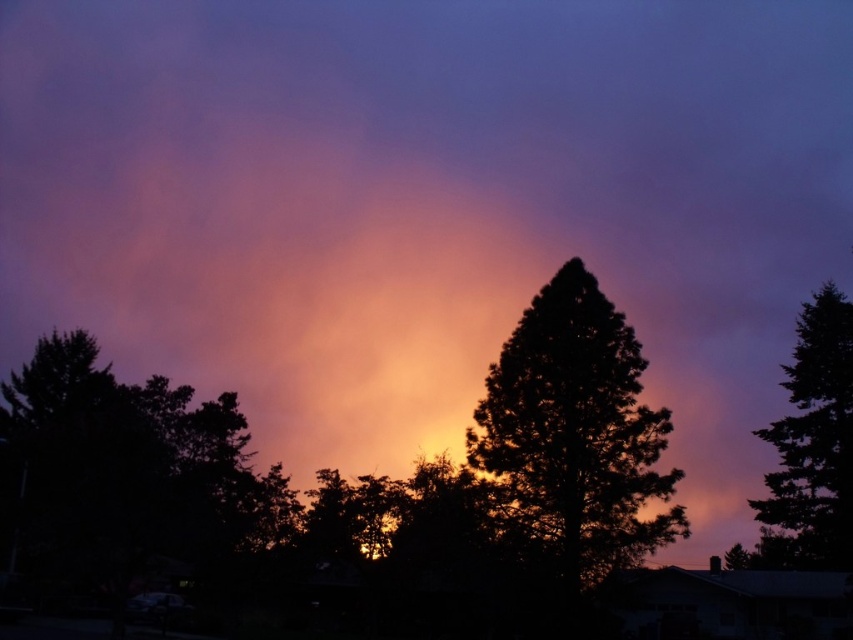
You are an observer looking at the twilight scene. You notice the dark green leafy tree at left and the dark green textured tree at right. Which tree is closer to you?

The dark green leafy tree at left is closer because it is in front of the dark green textured tree at right.

You are an architect designing a new observatory. You want to place two telescopes at the coordinates point (64, 524) and point (776, 429). Which telescope will have a clearer view of the stars because it is not blocked by the tallest tree in the center?

The telescope at point (64, 524) will have a clearer view because it is positioned in front of point (776, 429), meaning it is closer to the observer and less likely to be obstructed by the tallest tree in the center.

Based on the photo, you are standing in the twilight scene and want to take a photo of both the dark green leafy tree at left and the dark green textured tree at center. Which tree should you focus on first to ensure both are in sharp focus?

You should focus on the dark green textured tree at center first because it is farther away than the dark green leafy tree at left, ensuring both will be in focus when focusing on the farther object.